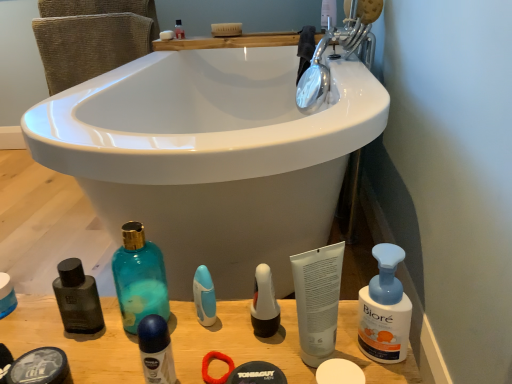
Where is `free space to the left of translucent plastic pump at right, the first cleaning product from the right`? free space to the left of translucent plastic pump at right, the first cleaning product from the right is located at coordinates (260, 342).